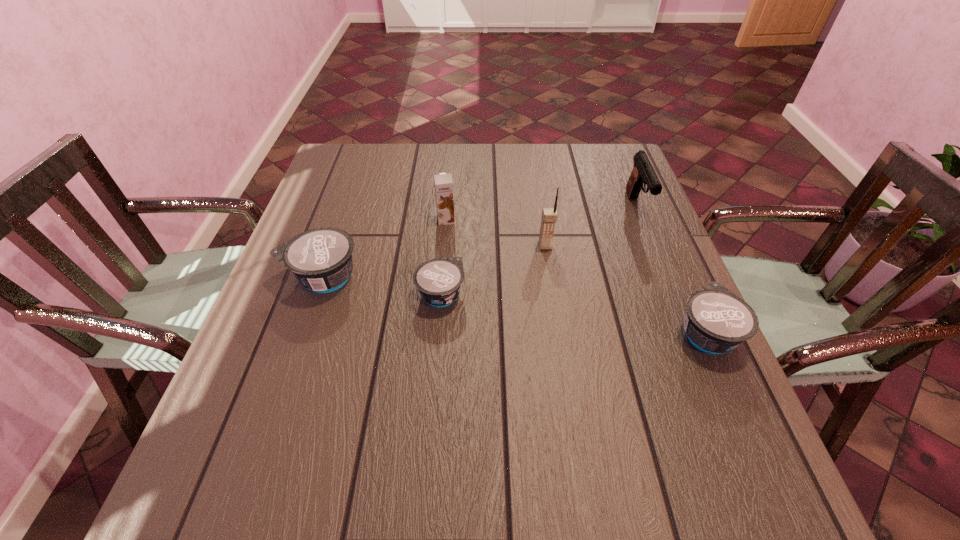
Where is `free space at the left edge`? Image resolution: width=960 pixels, height=540 pixels. free space at the left edge is located at coordinates (262, 348).

Locate an element on the screen. The image size is (960, 540). vacant space at the right edge is located at coordinates (686, 353).

Find the location of a particular element. This screenshot has width=960, height=540. vacant point at the far right corner is located at coordinates (593, 152).

Locate an element on the screen. This screenshot has height=540, width=960. free spot between the fourth object from left to right and the shortest object is located at coordinates (493, 270).

Find the location of `empty space between the pistol and the chocolate milk`. empty space between the pistol and the chocolate milk is located at coordinates (541, 214).

Find the location of a particular element. free spot between the shortest yogurt and the second shortest object is located at coordinates (573, 314).

Find the location of `vacant area between the tallest object and the rightmost yogurt`. vacant area between the tallest object and the rightmost yogurt is located at coordinates (626, 289).

Where is `free space between the leftmost object and the fifth tallest object`? free space between the leftmost object and the fifth tallest object is located at coordinates (515, 305).

Locate an element on the screen. The width and height of the screenshot is (960, 540). empty location between the pistol and the cellular telephone is located at coordinates (591, 227).

Where is `free space between the fifth tallest object and the chocolate milk`? Image resolution: width=960 pixels, height=540 pixels. free space between the fifth tallest object and the chocolate milk is located at coordinates (576, 276).